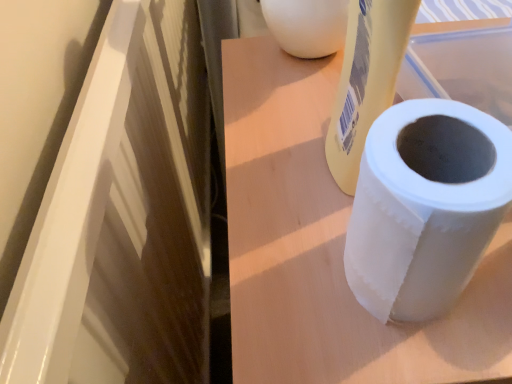
This screenshot has width=512, height=384. In order to click on free location to the left of white matte toilet paper at right in this screenshot , I will do `click(289, 273)`.